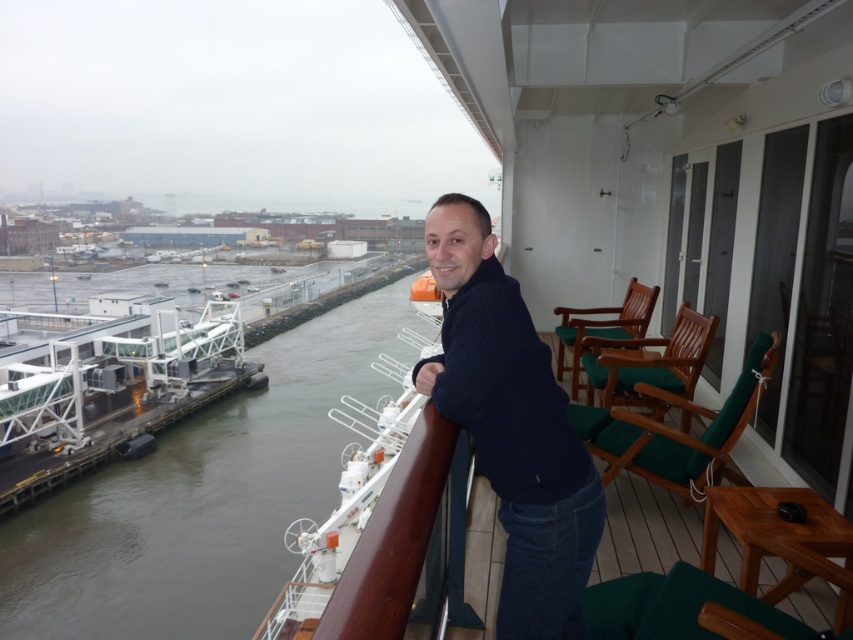
Can you confirm if dark blue ribbed sweater at center is positioned below dark blue fabric at center?

No.

Is point (556, 625) closer to viewer compared to point (821, 520)?

Yes, point (556, 625) is closer to viewer.

Locate an element on the screen. The height and width of the screenshot is (640, 853). dark blue ribbed sweater at center is located at coordinates (511, 426).

Who is more forward, (154, 618) or (738, 516)?

Positioned in front is point (738, 516).

Is point (248, 529) positioned after point (634, 444)?

That is True.

Locate an element on the screen. This screenshot has height=640, width=853. brown water at center is located at coordinates (202, 497).

The width and height of the screenshot is (853, 640). I want to click on brown water at center, so click(202, 497).

Is point (368, 298) positioned in front of point (509, 484)?

No, (368, 298) is behind (509, 484).

Is point (102, 582) positioned after point (480, 214)?

Yes, point (102, 582) is farther from viewer.

Where is `brown water at center`? brown water at center is located at coordinates (202, 497).